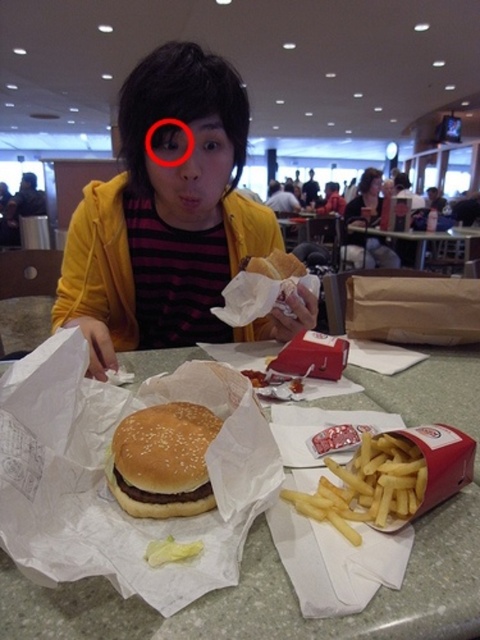
Does yellow matte jacket at center appear on the left side of smooth plastic table at center?

Yes, yellow matte jacket at center is to the left of smooth plastic table at center.

Is yellow matte jacket at center below smooth plastic table at center?

Yes.

Describe the element at coordinates (169, 220) in the screenshot. I see `yellow matte jacket at center` at that location.

This screenshot has width=480, height=640. In order to click on yellow matte jacket at center in this screenshot , I will do `click(169, 220)`.

Based on the photo, which of these two, semi-glossy bun at center or smooth plastic table at center, stands taller?

smooth plastic table at center is taller.

Identify the location of semi-glossy bun at center. (163, 460).

Is point (168, 461) in front of point (414, 234)?

Yes, it is.

At what (x,y) coordinates should I click in order to perform the action: click on semi-glossy bun at center. Please return your answer as a coordinate pair (x, y). Looking at the image, I should click on (163, 460).

Can you confirm if yellow matte jacket at center is positioned below semi-glossy bun at center?

Actually, yellow matte jacket at center is above semi-glossy bun at center.

Locate an element on the screen. This screenshot has width=480, height=640. yellow matte jacket at center is located at coordinates click(169, 220).